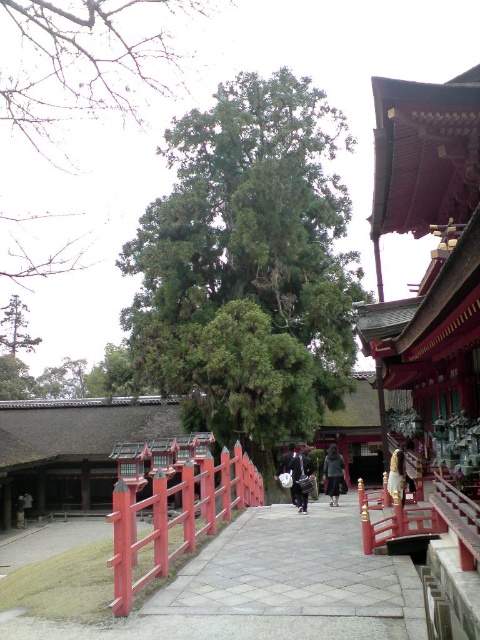
Who is positioned more to the right, smooth glossy wood at center or brown leather jacket at center?

Positioned to the right is brown leather jacket at center.

Which is behind, point (214, 515) or point (398, 474)?

The point (214, 515) is more distant.

Image resolution: width=480 pixels, height=640 pixels. Find the location of `smooth glossy wood at center`. smooth glossy wood at center is located at coordinates (177, 515).

From the picture: Between dark blue fabric bag at center and brown leather jacket at center, which one appears on the left side from the viewer's perspective?

From the viewer's perspective, dark blue fabric bag at center appears more on the left side.

Which is more to the right, dark blue fabric bag at center or brown leather jacket at center?

From the viewer's perspective, brown leather jacket at center appears more on the right side.

Which is behind, point (300, 500) or point (403, 461)?

The point (300, 500) is behind.

Where is `dark blue fabric bag at center`? The image size is (480, 640). dark blue fabric bag at center is located at coordinates (301, 480).

Does point (119, 477) come closer to viewer compared to point (326, 465)?

Yes, it is.

From the picture: Does smooth glossy wood at center appear on the right side of dark gray fabric pants at center?

In fact, smooth glossy wood at center is to the left of dark gray fabric pants at center.

Which is in front, point (187, 492) or point (334, 474)?

Positioned in front is point (187, 492).

Locate an element on the screen. This screenshot has height=640, width=480. smooth glossy wood at center is located at coordinates (177, 515).